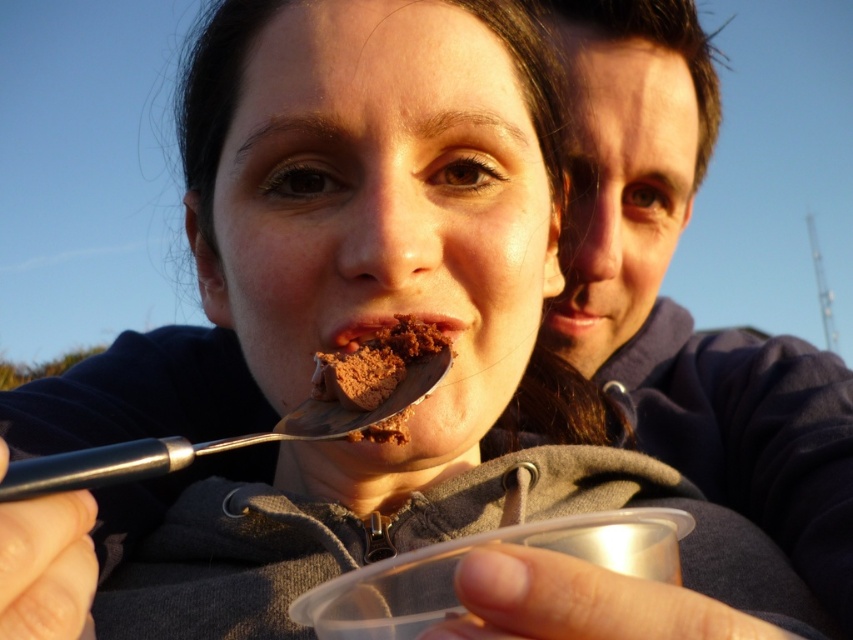
Can you confirm if matte blue hoodie at upper right is positioned above chocolate crumbly dessert at mouth?

Yes.

Does point (608, 250) lie in front of point (405, 419)?

That is False.

Locate an element on the screen. Image resolution: width=853 pixels, height=640 pixels. matte blue hoodie at upper right is located at coordinates (677, 305).

Is chocolate crumbly dessert at mouth taller than chocolate matte at center?

Yes, chocolate crumbly dessert at mouth is taller than chocolate matte at center.

Does chocolate crumbly dessert at mouth have a lesser width compared to chocolate matte at center?

In fact, chocolate crumbly dessert at mouth might be wider than chocolate matte at center.

This screenshot has height=640, width=853. Describe the element at coordinates (376, 364) in the screenshot. I see `chocolate crumbly dessert at mouth` at that location.

Identify the location of chocolate crumbly dessert at mouth. (376, 364).

Between matte blue hoodie at upper right and chocolate matte at center, which one has more height?

With more height is matte blue hoodie at upper right.

Can you confirm if matte blue hoodie at upper right is smaller than chocolate matte at center?

Actually, matte blue hoodie at upper right might be larger than chocolate matte at center.

Image resolution: width=853 pixels, height=640 pixels. What do you see at coordinates (677, 305) in the screenshot? I see `matte blue hoodie at upper right` at bounding box center [677, 305].

Find the location of a particular element. This screenshot has width=853, height=640. matte blue hoodie at upper right is located at coordinates (677, 305).